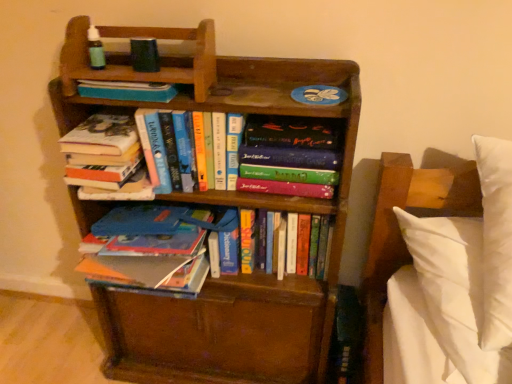
You are a GUI agent. You are given a task and a screenshot of the screen. Output one action in this format:
    pyautogui.click(x=<x>, y=<y>)
    Task: Click on the empty space that is ontop of hardcover books at center, which is the first book from left to right
    The width and height of the screenshot is (512, 384).
    Given the screenshot: What is the action you would take?
    pyautogui.click(x=104, y=118)